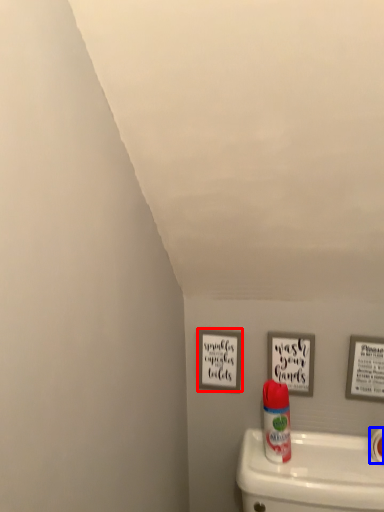
Question: Which object appears closest to the camera in this image, picture frame (highlighted by a red box) or toilet paper (highlighted by a blue box)?

Choices:
 (A) picture frame
 (B) toilet paper

Answer: (B)